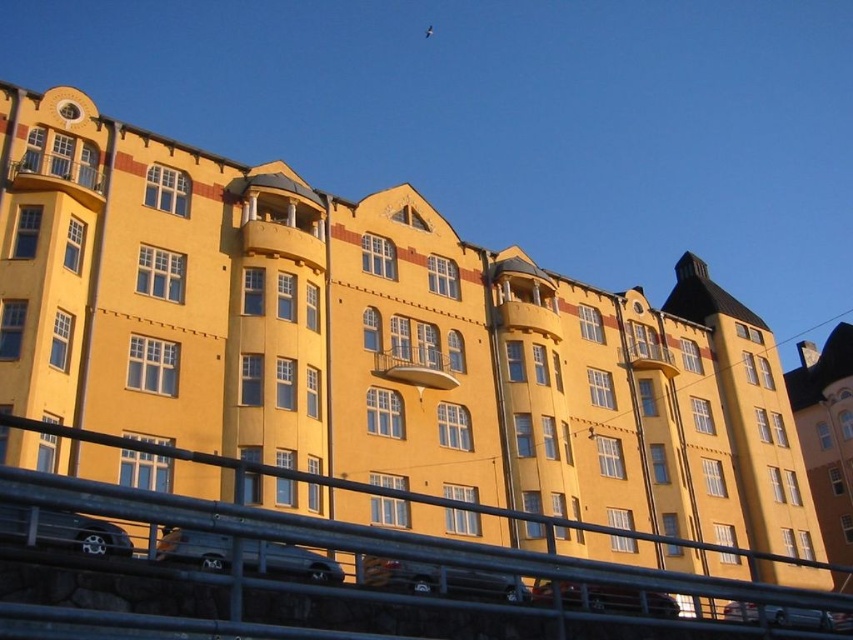
Question: Does silver metallic van at lower center appear on the right side of metallic silver car at lower center?

Choices:
 (A) yes
 (B) no

Answer: (B)

Question: Among these points, which one is farthest from the camera?

Choices:
 (A) (659, 605)
 (B) (466, 593)
 (C) (310, 550)

Answer: (A)

Question: Does metallic gray rail at lower center appear under metallic silver car at lower center?

Choices:
 (A) yes
 (B) no

Answer: (A)

Question: Is silver metallic van at lower center to the left of metallic silver car at lower center from the viewer's perspective?

Choices:
 (A) no
 (B) yes

Answer: (B)

Question: Considering the real-world distances, which object is closest to the shiny silver car at lower left?

Choices:
 (A) metallic silver car at lower center
 (B) silver metallic van at lower center

Answer: (B)

Question: Which object is the farthest from the metallic silver car at lower right?

Choices:
 (A) silver metallic van at lower center
 (B) metallic gray rail at lower center
 (C) metallic silver car at lower center
 (D) metallic silver car at center

Answer: (A)